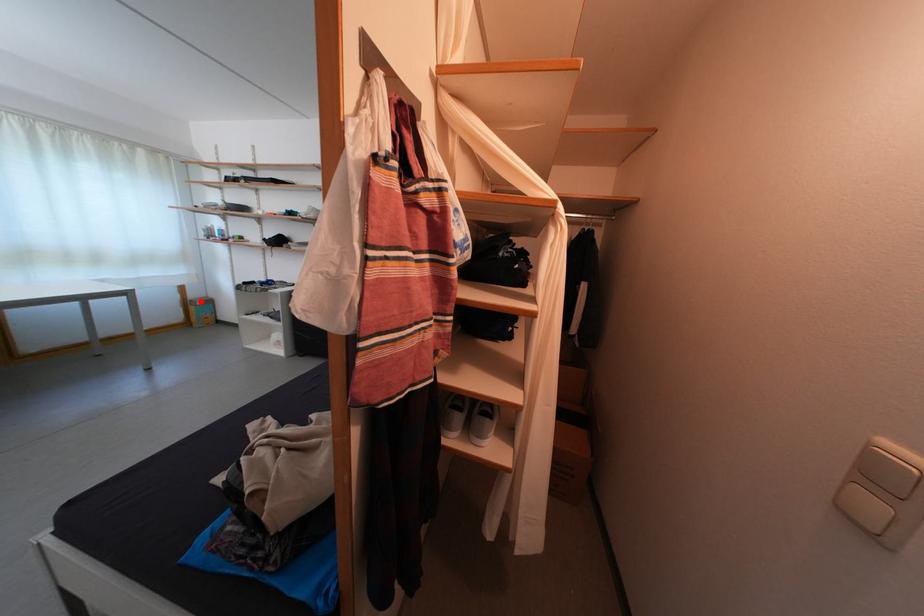
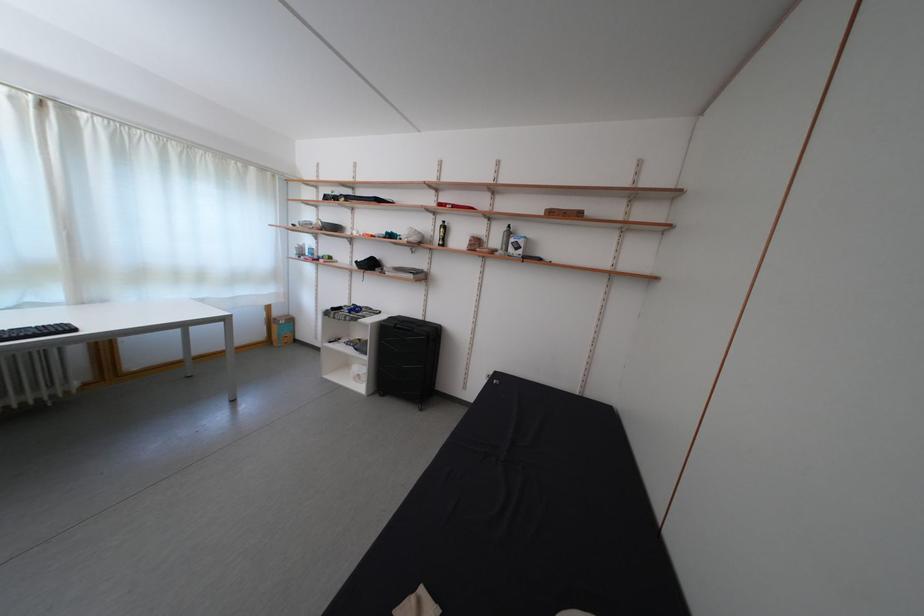
The point at the highlighted location is marked in the first image. Where is the corresponding point in the second image?

(285, 320)